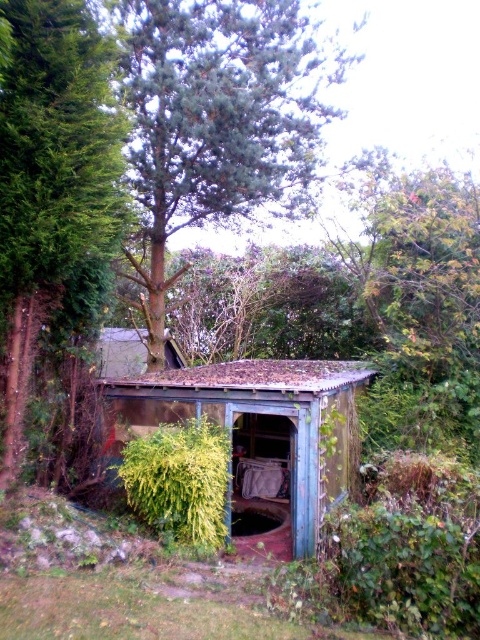
Can you confirm if green leafy tree at upper center is shorter than weathered wood shed at center?

In fact, green leafy tree at upper center may be taller than weathered wood shed at center.

Is green leafy tree at upper center above weathered wood shed at center?

Yes, green leafy tree at upper center is above weathered wood shed at center.

Is point (232, 76) more distant than point (294, 372)?

That is False.

The height and width of the screenshot is (640, 480). Identify the location of green leafy tree at upper center. (216, 120).

Can you confirm if green leafy tree at left is shorter than weathered wood shed at center?

No.

Who is taller, green leafy tree at left or weathered wood shed at center?

Standing taller between the two is green leafy tree at left.

I want to click on green leafy tree at left, so click(50, 179).

Which is behind, point (312, 160) or point (157, 476)?

Positioned behind is point (312, 160).

Where is `green leafy tree at upper center`? The height and width of the screenshot is (640, 480). green leafy tree at upper center is located at coordinates (216, 120).